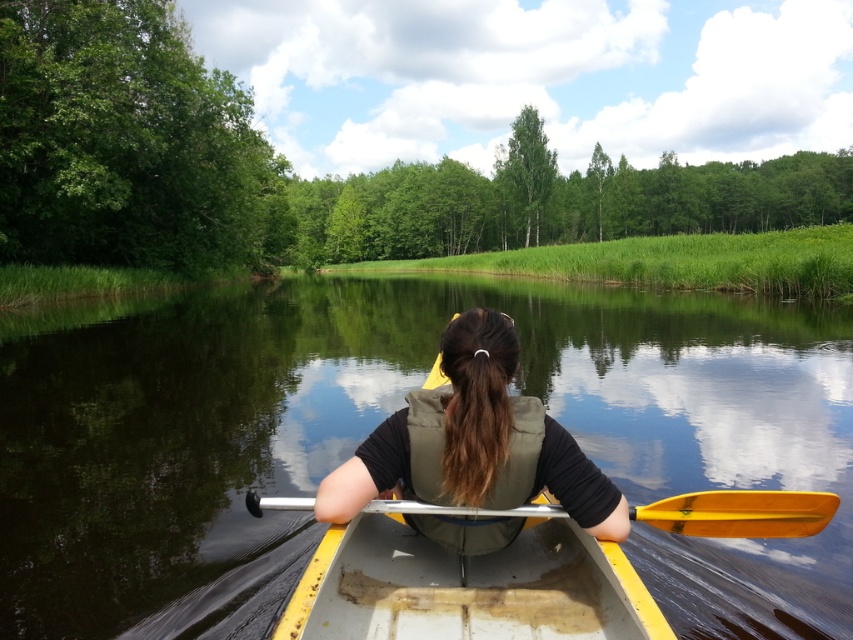
You are a photographer taking a picture of the yellow plastic canoe at center and the yellow plastic paddle at center. Based on their positions in the image, which object is closer to the bottom edge of the photo?

The yellow plastic canoe at center is closer to the bottom edge of the photo because it is located below the yellow plastic paddle at center.

You are a photographer trying to capture the kayaker from the shore. You notice the matte green life vest at center and the yellow plastic paddle at center. Which object is positioned more to the left in the image?

The matte green life vest at center is positioned to the left of the yellow plastic paddle at center, so the life vest is more to the left.